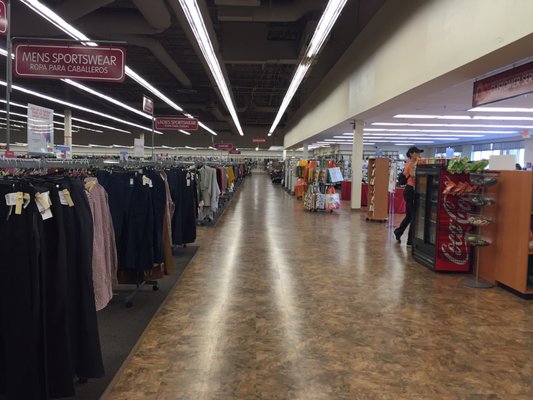
Locate an element on the screen. This screenshot has width=533, height=400. fridge is located at coordinates (452, 257).